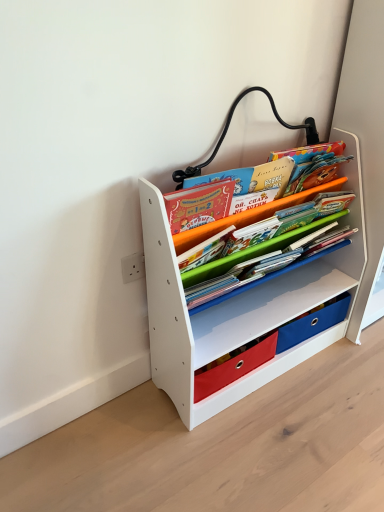
Find the location of a particular element. free space above matte paper book at center (from a real-world perspective) is located at coordinates (274, 195).